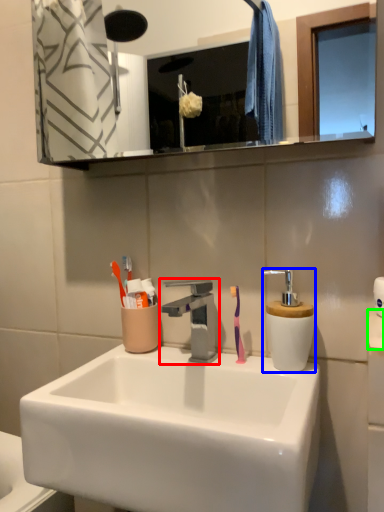
Question: Which object is the closest to the tap (highlighted by a red box)? Choose among these: soap dispenser (highlighted by a blue box) or toilet paper (highlighted by a green box).

Choices:
 (A) soap dispenser
 (B) toilet paper

Answer: (A)